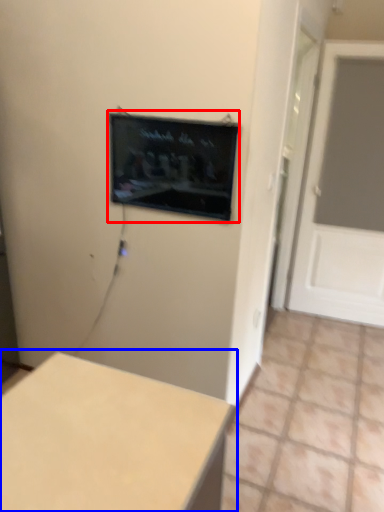
Question: Which of the following is the closest to the observer, computer screen (highlighted by a red box) or table (highlighted by a blue box)?

Choices:
 (A) computer screen
 (B) table

Answer: (B)